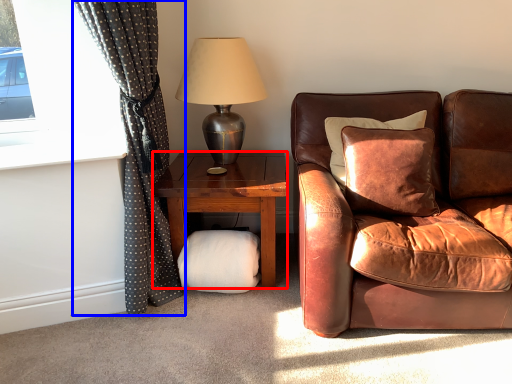
Question: Which point is closer to the camera, studio couch (highlighted by a red box) or curtain (highlighted by a blue box)?

Choices:
 (A) studio couch
 (B) curtain

Answer: (B)